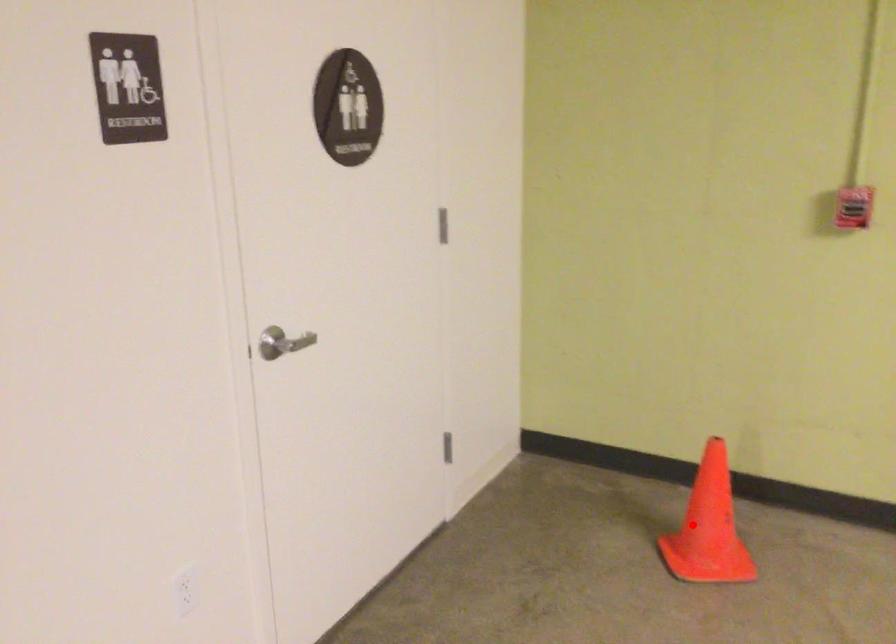
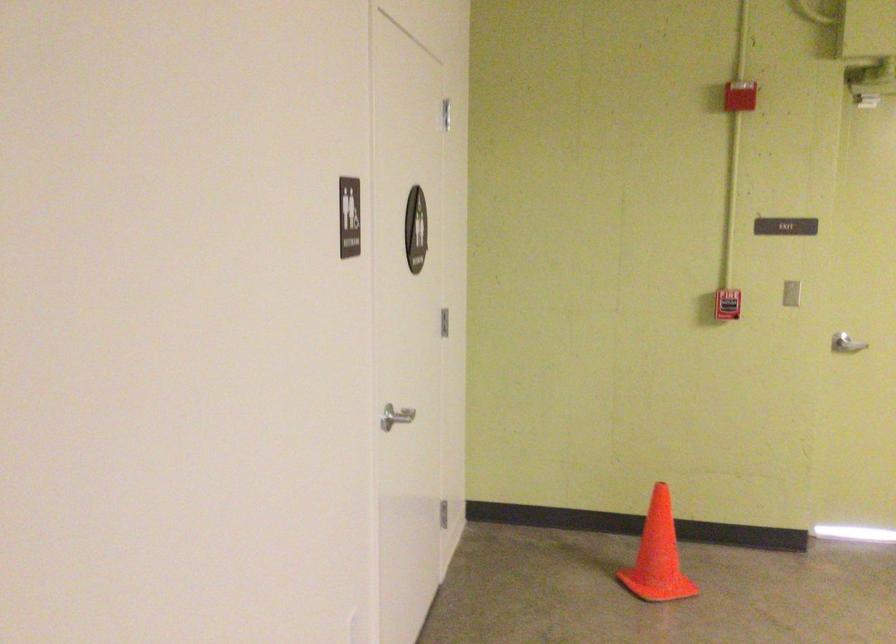
Question: A red point is marked in image1. In image2, is the corresponding 3D point closer to the camera or farther? Reply with the corresponding letter.

Choices:
 (A) The corresponding 3D point is closer.
 (B) The corresponding 3D point is farther.

Answer: (B)